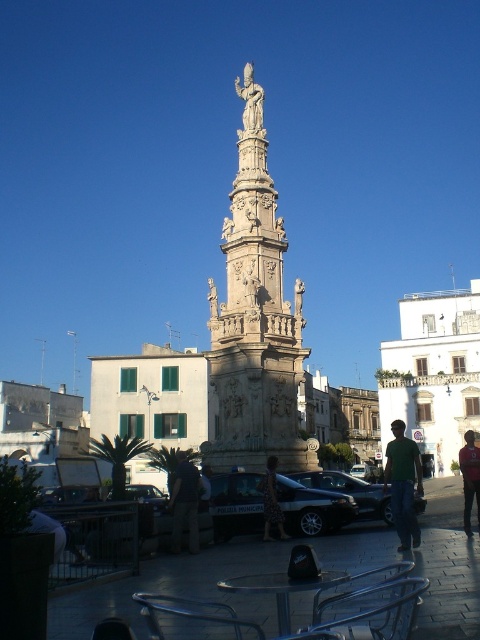
You are a photographer standing in the public square. You notice a person wearing a green matte shirt at center and a shiny black sedan at center. Which object is positioned higher in the scene?

The green matte shirt at center is located above the shiny black sedan at center, so the person wearing the green matte shirt at center is positioned higher in the scene.

You are standing in the public square and see two people wearing green clothing. One is wearing a green matte shirt at center and the other a dark green fabric jacket at lower center. Which person is standing to the right of the other?

The green matte shirt at center is positioned on the right side of dark green fabric jacket at lower center, so the person wearing the green matte shirt at center is standing to the right of the person wearing the dark green fabric jacket at lower center.

You are a photographer planning to take a picture of the white stone statue at upper center and the metallic silver car at center from the front. Which object should you focus on first if you want to capture both in the same frame without moving the camera?

You should focus on the white stone statue at upper center first because it is taller than the metallic silver car at center, so it will occupy more space in the frame and ensure proper composition.